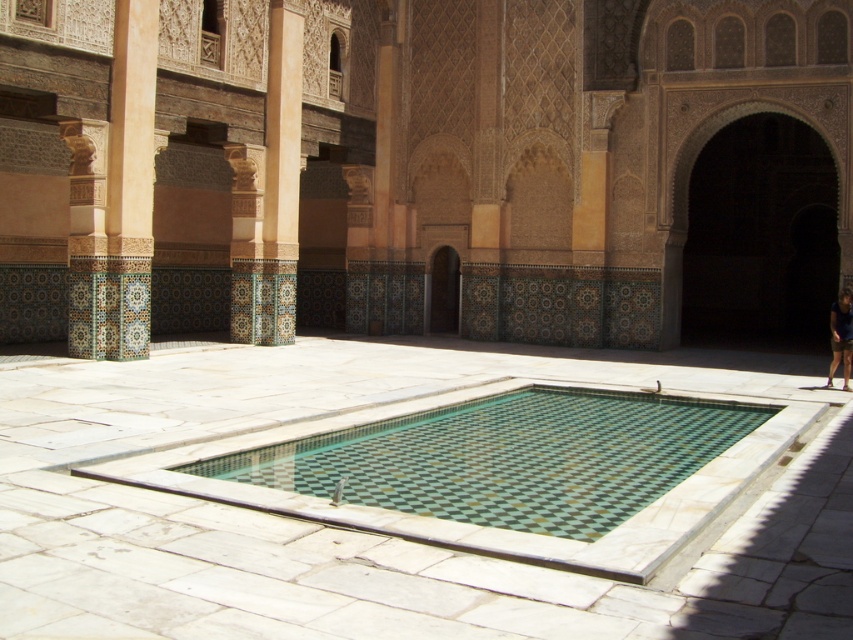
Question: Which is farther from the dark blue fabric at lower right?

Choices:
 (A) green mosaic pool at center
 (B) dark stone archway at center
 (C) green mosaic tile swimming pool at center

Answer: (A)

Question: Does green mosaic tile swimming pool at center come behind dark blue fabric at lower right?

Choices:
 (A) yes
 (B) no

Answer: (B)

Question: Which object is farther from the camera taking this photo?

Choices:
 (A) dark stone archway at center
 (B) dark blue fabric at lower right

Answer: (A)

Question: Can you confirm if green mosaic tile swimming pool at center is wider than dark stone archway at center?

Choices:
 (A) yes
 (B) no

Answer: (A)

Question: Can you confirm if dark stone archway at center is positioned below dark blue fabric at lower right?

Choices:
 (A) no
 (B) yes

Answer: (A)

Question: Estimate the real-world distances between objects in this image. Which object is farther from the green mosaic tile swimming pool at center?

Choices:
 (A) dark blue fabric at lower right
 (B) green mosaic pool at center
 (C) dark stone archway at center

Answer: (C)